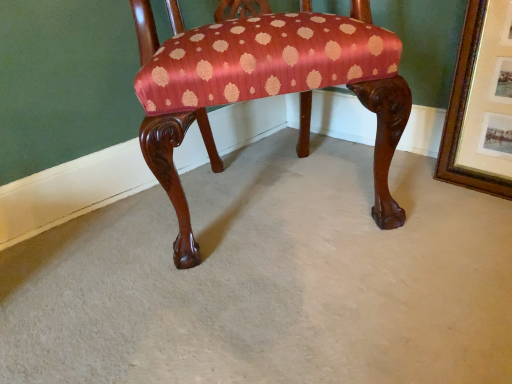
This screenshot has height=384, width=512. What do you see at coordinates (263, 86) in the screenshot? I see `silky red-patterned chair at center` at bounding box center [263, 86].

Measure the distance between silky red-patterned chair at center and camera.

The distance of silky red-patterned chair at center from camera is 33.76 inches.

In order to face silky red-patterned chair at center, should I rotate leftwards or rightwards?

A 0.607 degree turn to the right will do.

Find the location of a particular element. silky red-patterned chair at center is located at coordinates (263, 86).

This screenshot has width=512, height=384. Describe the element at coordinates (481, 104) in the screenshot. I see `gold-framed picture at upper right` at that location.

Where is `gold-framed picture at upper right`? The image size is (512, 384). gold-framed picture at upper right is located at coordinates (481, 104).

You are a GUI agent. You are given a task and a screenshot of the screen. Output one action in this format:
    pyautogui.click(x=<x>, y=<y>)
    Task: Click on the silky red-patterned chair at center
    Image resolution: width=512 pixels, height=384 pixels.
    Given the screenshot: What is the action you would take?
    pyautogui.click(x=263, y=86)

Considering the positions of objects silky red-patterned chair at center and gold-framed picture at upper right in the image provided, who is more to the left, silky red-patterned chair at center or gold-framed picture at upper right?

silky red-patterned chair at center is more to the left.

Which object is closer to the camera, silky red-patterned chair at center or gold-framed picture at upper right?

silky red-patterned chair at center is in front.

Does point (169, 178) come behind point (490, 11)?

That is False.

Looking at this image, from the image's perspective, is silky red-patterned chair at center beneath gold-framed picture at upper right?

No, from the image's perspective, silky red-patterned chair at center is not below gold-framed picture at upper right.

Looking at this image, from a real-world perspective, is silky red-patterned chair at center on top of gold-framed picture at upper right?

Yes, from a real-world perspective, silky red-patterned chair at center is over gold-framed picture at upper right

Can you confirm if silky red-patterned chair at center is wider than gold-framed picture at upper right?

Correct, the width of silky red-patterned chair at center exceeds that of gold-framed picture at upper right.

Who is taller, silky red-patterned chair at center or gold-framed picture at upper right?

silky red-patterned chair at center.

Can you confirm if silky red-patterned chair at center is bigger than gold-framed picture at upper right?

Yes.

Would you say silky red-patterned chair at center is inside or outside gold-framed picture at upper right?

The correct answer is: outside.

Is silky red-patterned chair at center next to gold-framed picture at upper right and touching it?

There is a gap between silky red-patterned chair at center and gold-framed picture at upper right.

Is silky red-patterned chair at center facing towards gold-framed picture at upper right?

No, silky red-patterned chair at center is not aimed at gold-framed picture at upper right.

Consider the image. How many degrees apart are the facing directions of silky red-patterned chair at center and gold-framed picture at upper right?

57.6 degrees separate the facing orientations of silky red-patterned chair at center and gold-framed picture at upper right.

Identify the location of picture frame below the silky red-patterned chair at center (from a real-world perspective). (481, 104).

Is gold-framed picture at upper right to the left or to the right of silky red-patterned chair at center in the image?

gold-framed picture at upper right is to the right of silky red-patterned chair at center.

Based on the photo, is the position of gold-framed picture at upper right more distant than that of silky red-patterned chair at center?

Yes.

Which is closer, (x=488, y=50) or (x=186, y=247)?

The point (x=186, y=247) is closer.

In the scene shown: From the image's perspective, between gold-framed picture at upper right and silky red-patterned chair at center, who is located below?

From the image's view, gold-framed picture at upper right is below.

From a real-world perspective, is gold-framed picture at upper right over silky red-patterned chair at center?

No.

In the scene shown: Between gold-framed picture at upper right and silky red-patterned chair at center, which one has smaller width?

gold-framed picture at upper right.

Can you confirm if gold-framed picture at upper right is shorter than silky red-patterned chair at center?

Correct, gold-framed picture at upper right is not as tall as silky red-patterned chair at center.

Is gold-framed picture at upper right bigger or smaller than silky red-patterned chair at center?

Considering their sizes, gold-framed picture at upper right takes up less space than silky red-patterned chair at center.

Is gold-framed picture at upper right outside of silky red-patterned chair at center?

Yes, gold-framed picture at upper right is outside of silky red-patterned chair at center.

Is gold-framed picture at upper right next to silky red-patterned chair at center and touching it?

There is a gap between gold-framed picture at upper right and silky red-patterned chair at center.

Could you tell me if gold-framed picture at upper right is turned towards silky red-patterned chair at center?

Yes, gold-framed picture at upper right faces towards silky red-patterned chair at center.

In order to click on picture frame directly beneath the silky red-patterned chair at center (from a real-world perspective) in this screenshot , I will do `click(481, 104)`.

Find the location of a particular element. This screenshot has height=384, width=512. chair on the left of gold-framed picture at upper right is located at coordinates (263, 86).

The height and width of the screenshot is (384, 512). I want to click on picture frame on the right of silky red-patterned chair at center, so click(481, 104).